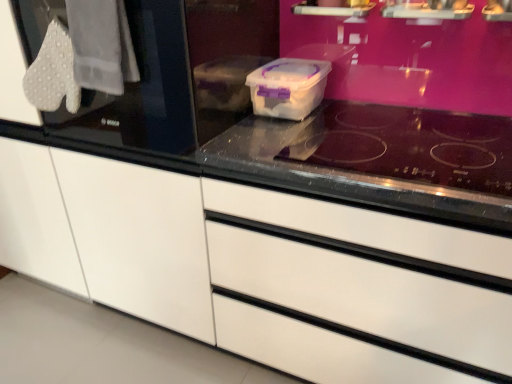
Question: Considering the relative positions of transparent glass at center and white glossy drawer at center in the image provided, is transparent glass at center to the right of white glossy drawer at center from the viewer's perspective?

Choices:
 (A) no
 (B) yes

Answer: (A)

Question: Is transparent glass at center positioned far away from white glossy drawer at center?

Choices:
 (A) yes
 (B) no

Answer: (B)

Question: Is transparent glass at center taller than white glossy drawer at center?

Choices:
 (A) no
 (B) yes

Answer: (A)

Question: Is transparent glass at center not within white glossy drawer at center?

Choices:
 (A) yes
 (B) no

Answer: (B)

Question: Does transparent glass at center lie behind white glossy drawer at center?

Choices:
 (A) no
 (B) yes

Answer: (B)

Question: Is transparent glass at center at the left side of white glossy drawer at center?

Choices:
 (A) yes
 (B) no

Answer: (A)

Question: Is the depth of transparent glass door at left greater than that of white textured gloves at upper left?

Choices:
 (A) no
 (B) yes

Answer: (A)

Question: Can you see transparent glass door at left touching white textured gloves at upper left?

Choices:
 (A) yes
 (B) no

Answer: (B)

Question: Would you say transparent glass door at left is outside white textured gloves at upper left?

Choices:
 (A) no
 (B) yes

Answer: (B)

Question: Does transparent glass door at left have a smaller size compared to white textured gloves at upper left?

Choices:
 (A) no
 (B) yes

Answer: (A)

Question: Considering the relative positions of transparent glass door at left and white textured gloves at upper left in the image provided, is transparent glass door at left to the left of white textured gloves at upper left from the viewer's perspective?

Choices:
 (A) yes
 (B) no

Answer: (B)

Question: Can you confirm if transparent glass door at left is wider than white textured gloves at upper left?

Choices:
 (A) no
 (B) yes

Answer: (B)

Question: From a real-world perspective, is white textured gloves at upper left positioned over white glossy drawer at center based on gravity?

Choices:
 (A) yes
 (B) no

Answer: (A)